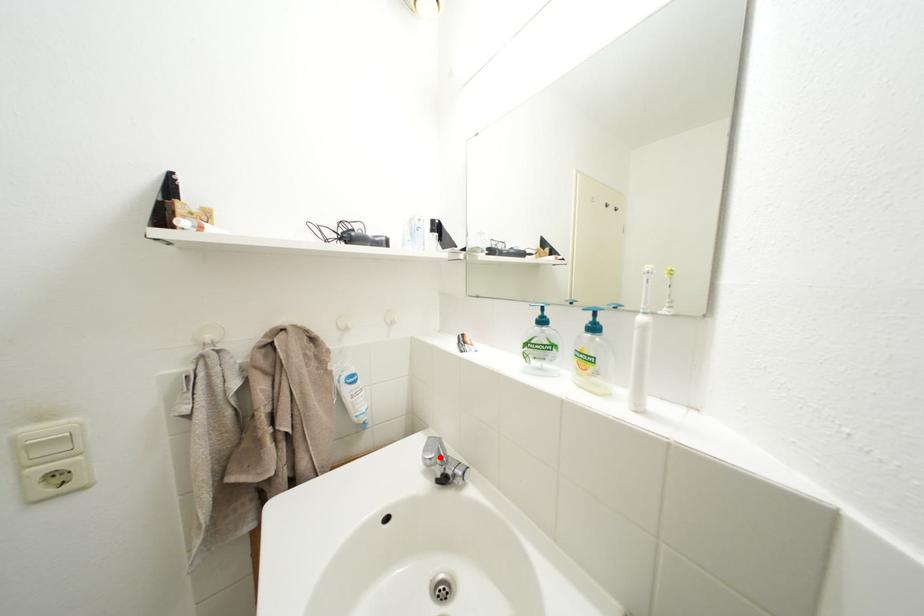
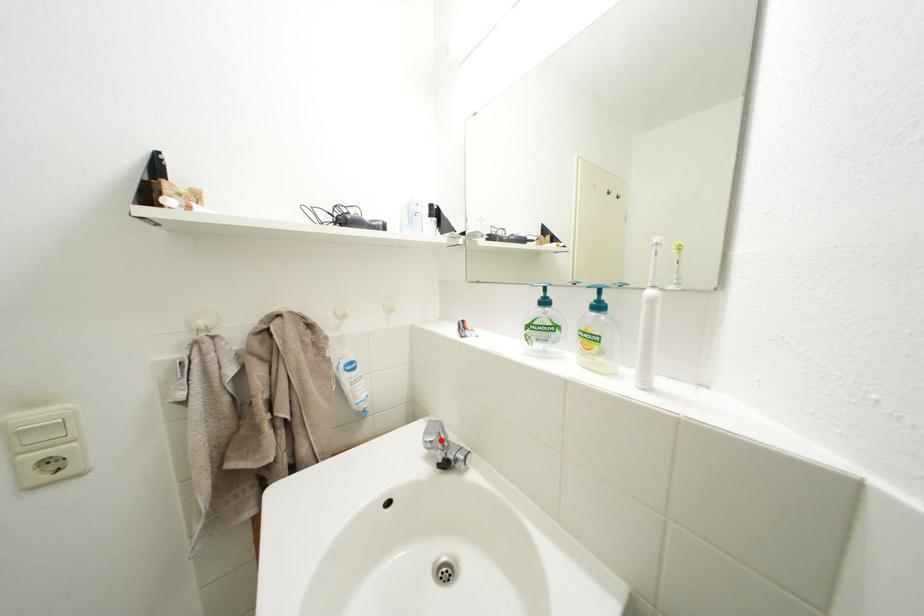
I am providing you with two images of the same scene from different viewpoints. A red point is marked on the first image and another point is marked on the second image. Are the points marked in image1 and image2 representing the same 3D position?

Yes